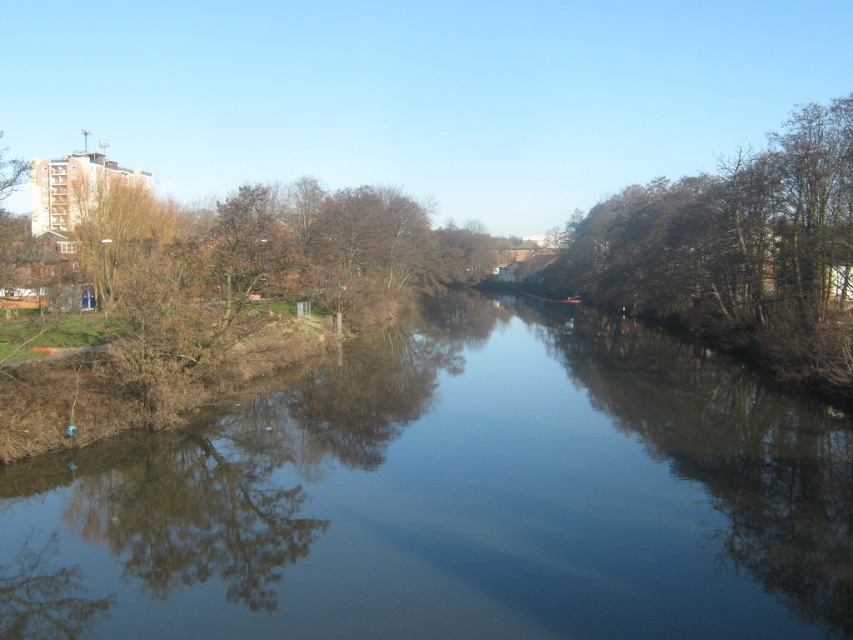
Can you confirm if brown leafy tree at right is wider than brown leafy tree at upper left?

Yes.

Can you confirm if brown leafy tree at right is thinner than brown leafy tree at upper left?

Incorrect, brown leafy tree at right's width is not less than brown leafy tree at upper left's.

The height and width of the screenshot is (640, 853). Identify the location of brown leafy tree at right. (735, 250).

Locate an element on the screen. The width and height of the screenshot is (853, 640). brown leafy tree at right is located at coordinates (735, 250).

Can you confirm if transparent water at center is bigger than brown leafy tree at upper left?

Incorrect, transparent water at center is not larger than brown leafy tree at upper left.

At what (x,y) coordinates should I click in order to perform the action: click on transparent water at center. Please return your answer as a coordinate pair (x, y). Looking at the image, I should click on (453, 499).

Describe the element at coordinates (453, 499) in the screenshot. I see `transparent water at center` at that location.

Which of these two, transparent water at center or brown leafy tree at right, stands shorter?

Standing shorter between the two is transparent water at center.

Locate an element on the screen. Image resolution: width=853 pixels, height=640 pixels. transparent water at center is located at coordinates (453, 499).

Image resolution: width=853 pixels, height=640 pixels. Identify the location of transparent water at center. (453, 499).